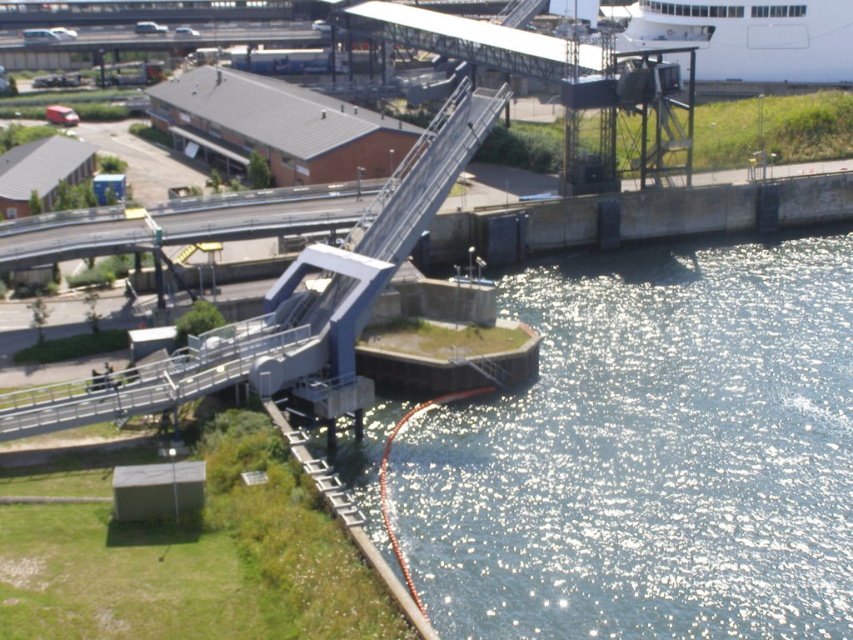
Can you confirm if shiny metallic water at lower right is wider than silver metallic rail at lower left?

Yes, shiny metallic water at lower right is wider than silver metallic rail at lower left.

The width and height of the screenshot is (853, 640). In order to click on shiny metallic water at lower right in this screenshot , I will do `click(648, 454)`.

Who is more forward, (795, 580) or (148, 371)?

Positioned in front is point (795, 580).

You are a GUI agent. You are given a task and a screenshot of the screen. Output one action in this format:
    pyautogui.click(x=<x>, y=<y>)
    Task: Click on the shiny metallic water at lower right
    
    Given the screenshot: What is the action you would take?
    pyautogui.click(x=648, y=454)

Is white glossy cruise ship at upper right further to the viewer compared to silver metallic rail at lower left?

Yes, white glossy cruise ship at upper right is behind silver metallic rail at lower left.

Who is taller, white glossy cruise ship at upper right or silver metallic rail at lower left?

With more height is white glossy cruise ship at upper right.

Describe the element at coordinates (747, 35) in the screenshot. The height and width of the screenshot is (640, 853). I see `white glossy cruise ship at upper right` at that location.

This screenshot has width=853, height=640. What are the coordinates of `white glossy cruise ship at upper right` in the screenshot? It's located at (747, 35).

Between shiny metallic water at lower right and white glossy cruise ship at upper right, which one has less height?

Standing shorter between the two is shiny metallic water at lower right.

Does shiny metallic water at lower right appear on the left side of white glossy cruise ship at upper right?

Indeed, shiny metallic water at lower right is positioned on the left side of white glossy cruise ship at upper right.

Is point (361, 499) behind point (817, 45)?

No.

Find the location of a particular element. This screenshot has width=853, height=640. shiny metallic water at lower right is located at coordinates (648, 454).